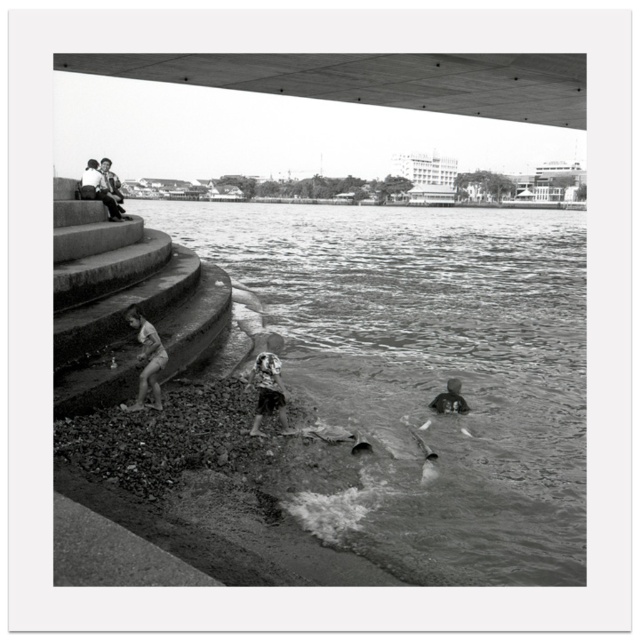
You are a tourist visiting the riverside and want to take a photo of the dark gray water at lower center and the smooth stone man at upper left. Where should you position yourself to capture both in the frame?

To capture both the dark gray water at lower center and the smooth stone man at upper left in the same frame, position yourself at a lower viewpoint so that the dark gray water at lower center is below the smooth stone man at upper left.

You are a photographer who wants to capture the dark gray water at lower center and the fluffy hair at lower center in a single shot. Which object would you need to frame more prominently in your composition?

The dark gray water at lower center is larger in size than the fluffy hair at lower center, so you should frame the dark gray water at lower center more prominently in your composition.